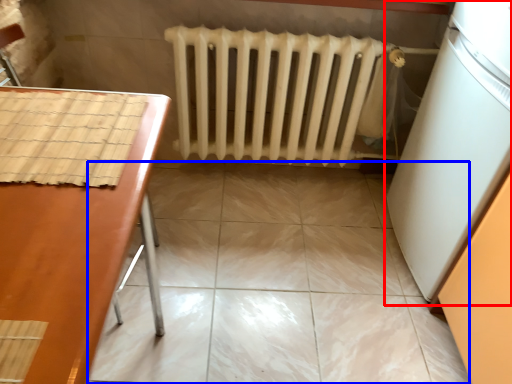
Question: Which point is further to the camera, appliance (highlighted by a red box) or ceramic tile (highlighted by a blue box)?

Choices:
 (A) appliance
 (B) ceramic tile

Answer: (B)